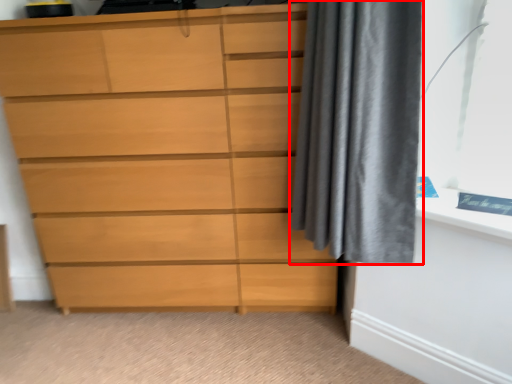
Question: In this image, where is curtain (annotated by the red box) located relative to chest of drawers?

Choices:
 (A) right
 (B) left

Answer: (A)